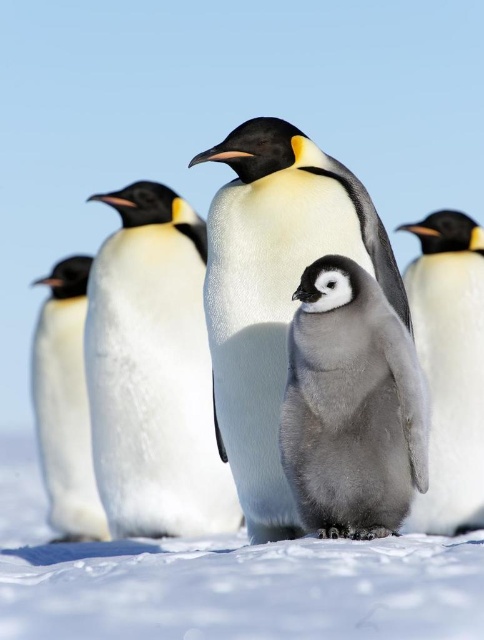
Between white fluffy snow at center and white fluffy penguin at right, which one appears on the left side from the viewer's perspective?

white fluffy snow at center is more to the left.

Who is more distant from viewer, (9,624) or (424,333)?

The point (424,333) is more distant.

What do you see at coordinates (225, 579) in the screenshot? The height and width of the screenshot is (640, 484). I see `white fluffy snow at center` at bounding box center [225, 579].

This screenshot has height=640, width=484. Find the location of `white fluffy snow at center`. white fluffy snow at center is located at coordinates (225, 579).

Does white fluffy penguin at center have a larger size compared to gray downy penguin at center?

Yes.

Can you confirm if white fluffy penguin at center is taller than gray downy penguin at center?

Correct, white fluffy penguin at center is much taller as gray downy penguin at center.

Describe the element at coordinates (274, 291) in the screenshot. I see `white fluffy penguin at center` at that location.

Where is `white fluffy penguin at center`? Image resolution: width=484 pixels, height=640 pixels. white fluffy penguin at center is located at coordinates (274, 291).

Is point (12, 596) positioned before point (382, 416)?

Yes.

Is white fluffy snow at center wider than gray downy penguin at center?

Yes.

Which is in front, point (162, 609) or point (332, 285)?

Point (162, 609) is more forward.

The height and width of the screenshot is (640, 484). I want to click on white fluffy snow at center, so (x=225, y=579).